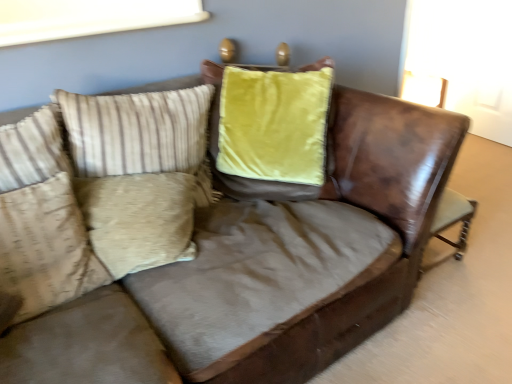
The height and width of the screenshot is (384, 512). Find the location of `beige striped pillow at left, which appears as the 1th pillow when viewed from the top`. beige striped pillow at left, which appears as the 1th pillow when viewed from the top is located at coordinates (141, 134).

How much space does beige striped pillow at left, which appears as the 1th pillow when viewed from the top, occupy vertically?

The height of beige striped pillow at left, which appears as the 1th pillow when viewed from the top, is 17.38 inches.

This screenshot has width=512, height=384. Describe the element at coordinates (141, 134) in the screenshot. I see `beige striped pillow at left, the second pillow from the bottom` at that location.

This screenshot has height=384, width=512. What do you see at coordinates (44, 251) in the screenshot?
I see `beige fabric pillow at left, the second pillow in the top-to-bottom sequence` at bounding box center [44, 251].

Where is `beige fabric pillow at left, the 1th pillow in the bottom-to-top sequence`? The height and width of the screenshot is (384, 512). beige fabric pillow at left, the 1th pillow in the bottom-to-top sequence is located at coordinates (44, 251).

Identify the location of beige striped pillow at left, which appears as the 1th pillow when viewed from the top. (141, 134).

Visually, is beige striped pillow at left, the second pillow from the bottom, positioned to the left or to the right of beige fabric pillow at left, the 1th pillow in the bottom-to-top sequence?

From the image, it's evident that beige striped pillow at left, the second pillow from the bottom, is to the right of beige fabric pillow at left, the 1th pillow in the bottom-to-top sequence.

Relative to beige fabric pillow at left, the 1th pillow in the bottom-to-top sequence, is beige striped pillow at left, the second pillow from the bottom, in front or behind?

beige striped pillow at left, the second pillow from the bottom, is behind beige fabric pillow at left, the 1th pillow in the bottom-to-top sequence.

Does point (150, 127) come farther from viewer compared to point (28, 199)?

Yes, it is behind point (28, 199).

From the image's perspective, which is above, beige striped pillow at left, the second pillow from the bottom, or beige fabric pillow at left, the second pillow in the top-to-bottom sequence?

beige striped pillow at left, the second pillow from the bottom, is shown above in the image.

From a real-world perspective, who is located higher, beige striped pillow at left, the second pillow from the bottom, or beige fabric pillow at left, the 1th pillow in the bottom-to-top sequence?

From a 3D spatial view, beige striped pillow at left, the second pillow from the bottom, is above.

Between beige striped pillow at left, the second pillow from the bottom, and beige fabric pillow at left, the second pillow in the top-to-bottom sequence, which one has larger width?

Wider between the two is beige striped pillow at left, the second pillow from the bottom.

Considering the sizes of beige striped pillow at left, which appears as the 1th pillow when viewed from the top, and beige fabric pillow at left, the second pillow in the top-to-bottom sequence, in the image, is beige striped pillow at left, which appears as the 1th pillow when viewed from the top, taller or shorter than beige fabric pillow at left, the second pillow in the top-to-bottom sequence,?

Considering their sizes, beige striped pillow at left, which appears as the 1th pillow when viewed from the top, has less height than beige fabric pillow at left, the second pillow in the top-to-bottom sequence.

Considering the sizes of objects beige striped pillow at left, which appears as the 1th pillow when viewed from the top, and beige fabric pillow at left, the 1th pillow in the bottom-to-top sequence, in the image provided, who is bigger, beige striped pillow at left, which appears as the 1th pillow when viewed from the top, or beige fabric pillow at left, the 1th pillow in the bottom-to-top sequence,?

beige striped pillow at left, which appears as the 1th pillow when viewed from the top, is bigger.

Would you say beige fabric pillow at left, the 1th pillow in the bottom-to-top sequence, is part of beige striped pillow at left, which appears as the 1th pillow when viewed from the top,'s contents?

No, beige fabric pillow at left, the 1th pillow in the bottom-to-top sequence, is not surrounded by beige striped pillow at left, which appears as the 1th pillow when viewed from the top.

Is there a large distance between beige striped pillow at left, the second pillow from the bottom, and beige fabric pillow at left, the 1th pillow in the bottom-to-top sequence?

No, beige striped pillow at left, the second pillow from the bottom, is not far from beige fabric pillow at left, the 1th pillow in the bottom-to-top sequence.

Is beige striped pillow at left, which appears as the 1th pillow when viewed from the top, turned away from beige fabric pillow at left, the 1th pillow in the bottom-to-top sequence?

No, beige striped pillow at left, which appears as the 1th pillow when viewed from the top, is not facing the opposite direction of beige fabric pillow at left, the 1th pillow in the bottom-to-top sequence.

How different are the orientations of beige striped pillow at left, which appears as the 1th pillow when viewed from the top, and beige fabric pillow at left, the 1th pillow in the bottom-to-top sequence, in degrees?

beige striped pillow at left, which appears as the 1th pillow when viewed from the top, and beige fabric pillow at left, the 1th pillow in the bottom-to-top sequence, are facing 2.47 degrees away from each other.

Identify the location of pillow lying on the left of beige striped pillow at left, the second pillow from the bottom. This screenshot has height=384, width=512. (44, 251).

Considering the positions of objects beige fabric pillow at left, the second pillow in the top-to-bottom sequence, and beige striped pillow at left, the second pillow from the bottom, in the image provided, who is more to the left, beige fabric pillow at left, the second pillow in the top-to-bottom sequence, or beige striped pillow at left, the second pillow from the bottom,?

Positioned to the left is beige fabric pillow at left, the second pillow in the top-to-bottom sequence.

Which is in front, beige fabric pillow at left, the second pillow in the top-to-bottom sequence, or beige striped pillow at left, which appears as the 1th pillow when viewed from the top?

beige fabric pillow at left, the second pillow in the top-to-bottom sequence, is in front.

Which point is more forward, (79, 264) or (77, 102)?

The point (79, 264) is closer to the camera.

From the image's perspective, is beige fabric pillow at left, the 1th pillow in the bottom-to-top sequence, over beige striped pillow at left, the second pillow from the bottom?

No, from the image's perspective, beige fabric pillow at left, the 1th pillow in the bottom-to-top sequence, is not above beige striped pillow at left, the second pillow from the bottom.

From a real-world perspective, is beige fabric pillow at left, the second pillow in the top-to-bottom sequence, located higher than beige striped pillow at left, which appears as the 1th pillow when viewed from the top?

Actually, beige fabric pillow at left, the second pillow in the top-to-bottom sequence, is physically below beige striped pillow at left, which appears as the 1th pillow when viewed from the top, in the real world.

Between beige fabric pillow at left, the 1th pillow in the bottom-to-top sequence, and beige striped pillow at left, which appears as the 1th pillow when viewed from the top, which one has larger width?

beige striped pillow at left, which appears as the 1th pillow when viewed from the top, is wider.

In the scene shown: Considering the sizes of objects beige fabric pillow at left, the 1th pillow in the bottom-to-top sequence, and beige striped pillow at left, the second pillow from the bottom, in the image provided, who is shorter, beige fabric pillow at left, the 1th pillow in the bottom-to-top sequence, or beige striped pillow at left, the second pillow from the bottom,?

Standing shorter between the two is beige striped pillow at left, the second pillow from the bottom.

Can you confirm if beige fabric pillow at left, the second pillow in the top-to-bottom sequence, is smaller than beige striped pillow at left, the second pillow from the bottom?

Yes.

Is beige fabric pillow at left, the 1th pillow in the bottom-to-top sequence, not within beige striped pillow at left, which appears as the 1th pillow when viewed from the top?

Yes, beige fabric pillow at left, the 1th pillow in the bottom-to-top sequence, is located beyond the bounds of beige striped pillow at left, which appears as the 1th pillow when viewed from the top.

Is beige striped pillow at left, which appears as the 1th pillow when viewed from the top, at the back of beige fabric pillow at left, the 1th pillow in the bottom-to-top sequence?

beige fabric pillow at left, the 1th pillow in the bottom-to-top sequence, does not have its back to beige striped pillow at left, which appears as the 1th pillow when viewed from the top.

Can you tell me how much beige fabric pillow at left, the 1th pillow in the bottom-to-top sequence, and beige striped pillow at left, which appears as the 1th pillow when viewed from the top, differ in facing direction?

The angular difference between beige fabric pillow at left, the 1th pillow in the bottom-to-top sequence, and beige striped pillow at left, which appears as the 1th pillow when viewed from the top, is 2.47 degrees.

Consider the image. How much distance is there between beige fabric pillow at left, the 1th pillow in the bottom-to-top sequence, and beige striped pillow at left, which appears as the 1th pillow when viewed from the top?

14.20 inches.

At what (x,y) coordinates should I click in order to perform the action: click on pillow on the left of beige striped pillow at left, the second pillow from the bottom. Please return your answer as a coordinate pair (x, y). The height and width of the screenshot is (384, 512). Looking at the image, I should click on (44, 251).

This screenshot has height=384, width=512. I want to click on pillow in front of the beige striped pillow at left, which appears as the 1th pillow when viewed from the top, so click(x=44, y=251).

At what (x,y) coordinates should I click in order to perform the action: click on pillow above the beige fabric pillow at left, the second pillow in the top-to-bottom sequence (from the image's perspective). Please return your answer as a coordinate pair (x, y). This screenshot has width=512, height=384. Looking at the image, I should click on (141, 134).